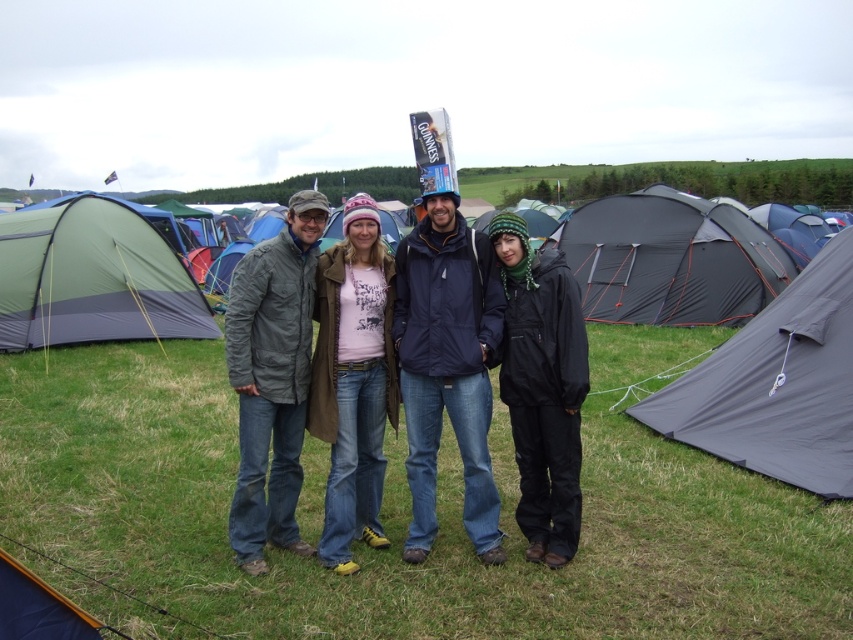
Between point (109, 328) and point (376, 468), which one is positioned in front?

Positioned in front is point (376, 468).

Is green fabric tent at left bigger than pink cotton t-shirt at center?

Yes.

Is point (61, 300) farther from camera compared to point (357, 470)?

That is True.

This screenshot has height=640, width=853. I want to click on green fabric tent at left, so click(x=91, y=278).

Who is taller, matte gray jacket at center or dark gray nylon tent at right?

dark gray nylon tent at right

Who is higher up, matte gray jacket at center or dark gray nylon tent at right?

dark gray nylon tent at right is higher up.

Where is `matte gray jacket at center`? The height and width of the screenshot is (640, 853). matte gray jacket at center is located at coordinates (405, 369).

Between point (329, 252) and point (561, 532), which one is positioned in front?

Point (561, 532) is more forward.

Identify the location of pink cotton t-shirt at center. (352, 380).

Locate an element on the screen. This screenshot has width=853, height=640. pink cotton t-shirt at center is located at coordinates (352, 380).